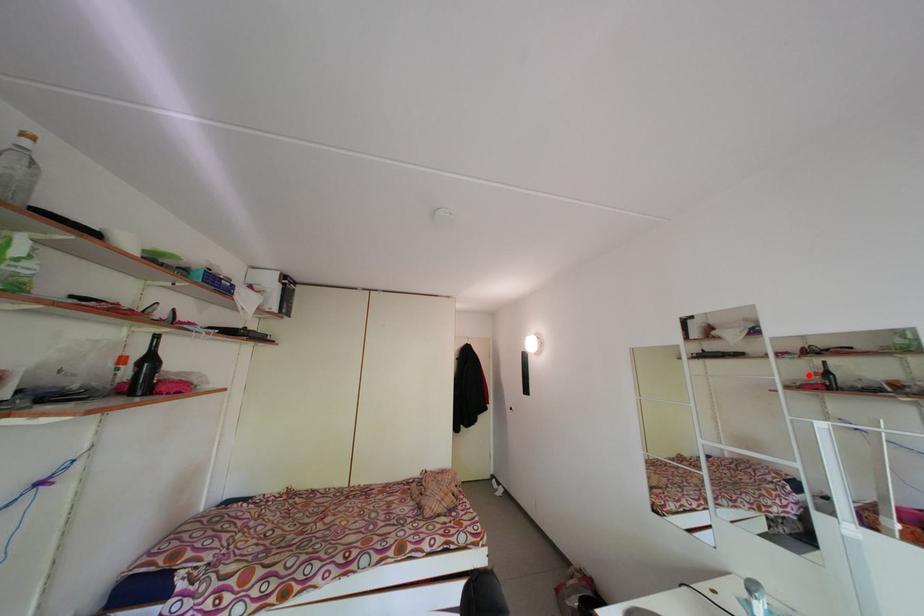
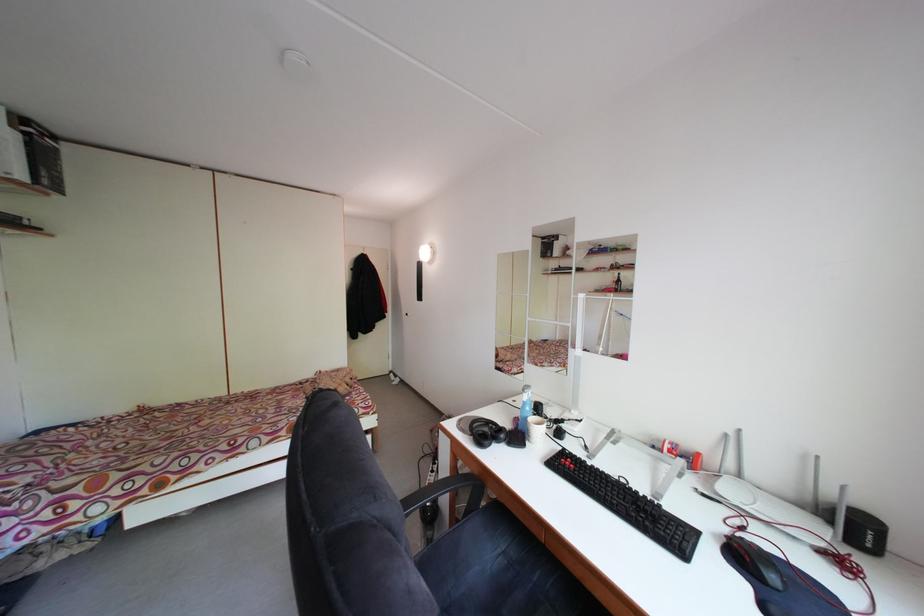
The point at the highlighted location is marked in the first image. Where is the corresponding point in the second image?

(614, 285)